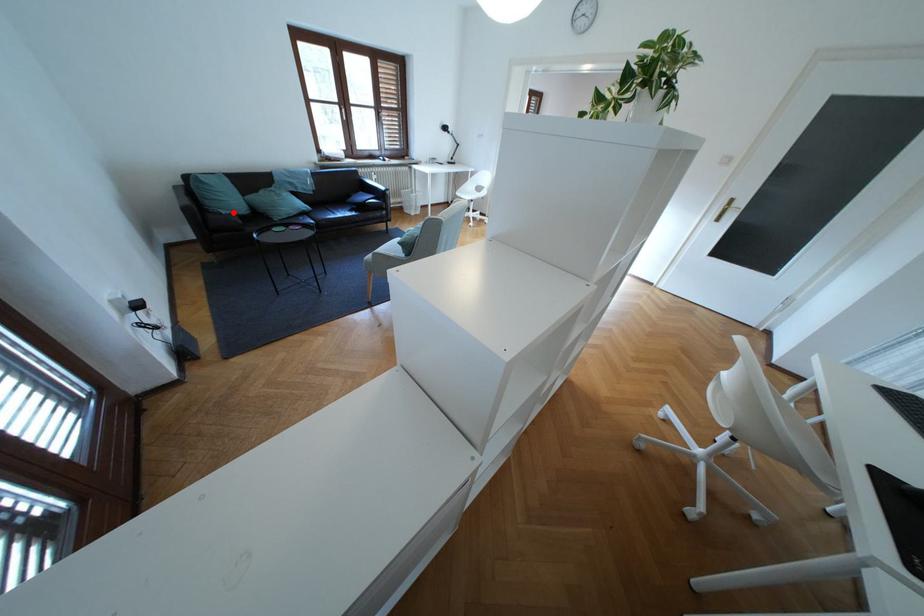
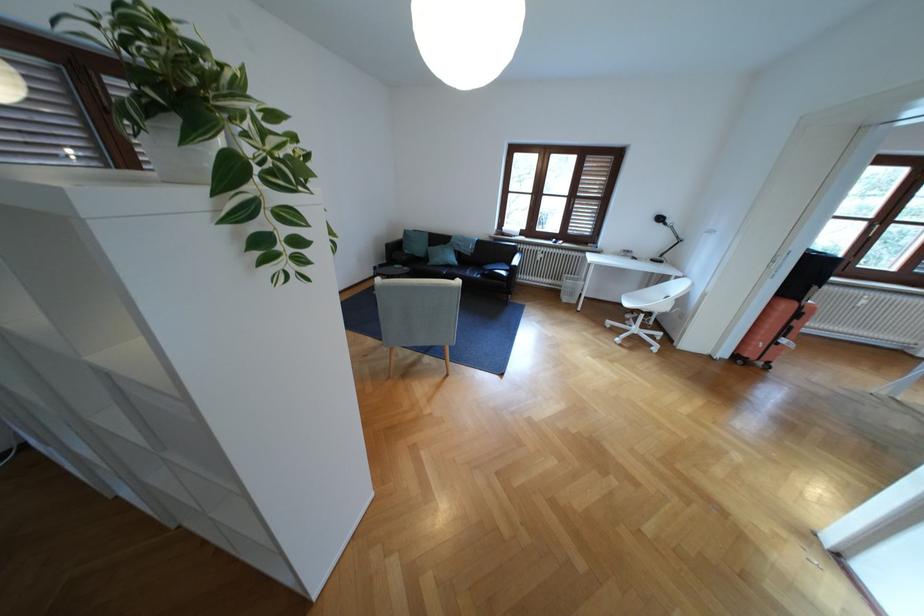
Question: I am providing you with two images of the same scene from different viewpoints. Given a red point in image1, look at the same physical point in image2. Is it:

Choices:
 (A) Closer to the viewpoint
 (B) Farther from the viewpoint

Answer: (B)